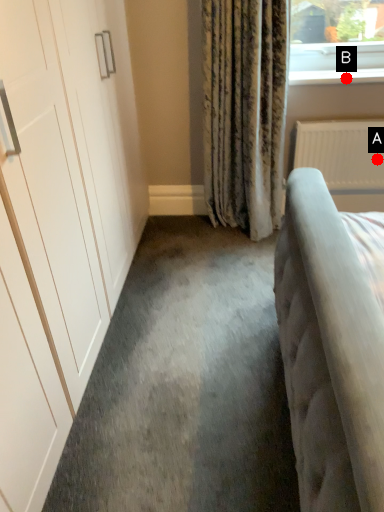
Question: Two points are circled on the image, labeled by A and B beside each circle. Which of the following is the closest to the observer?

Choices:
 (A) A is closer
 (B) B is closer

Answer: (B)